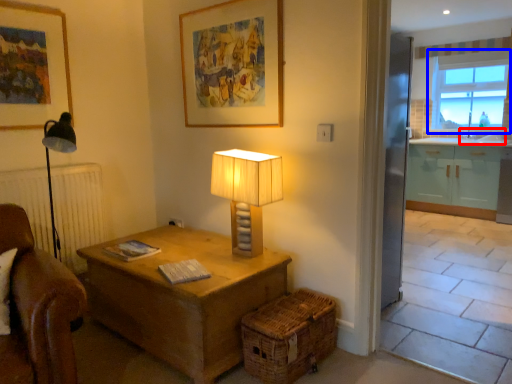
Question: Which object appears farthest to the camera in this image, sink (highlighted by a red box) or window (highlighted by a blue box)?

Choices:
 (A) sink
 (B) window

Answer: (B)